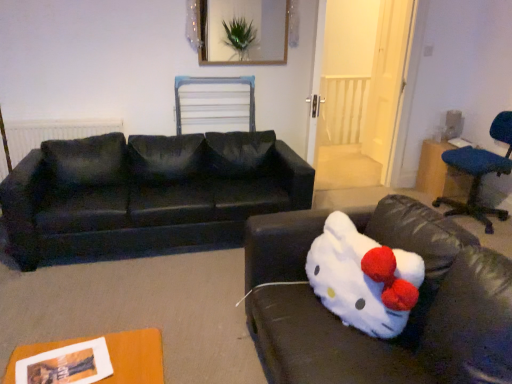
The image size is (512, 384). Identify the location of free space in front of black fabric couch at left, the first studio couch positioned from the back. (140, 298).